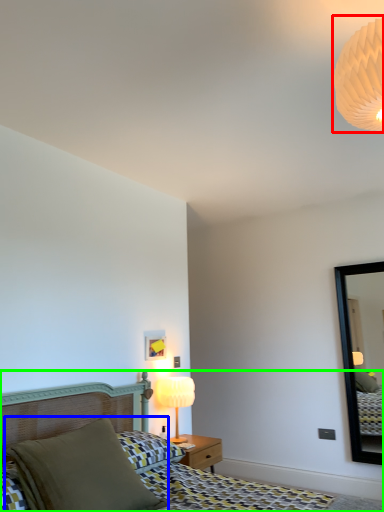
Question: Which is nearer to the lamp (highlighted by a red box)? pillow (highlighted by a blue box) or bed (highlighted by a green box).

Choices:
 (A) pillow
 (B) bed

Answer: (A)